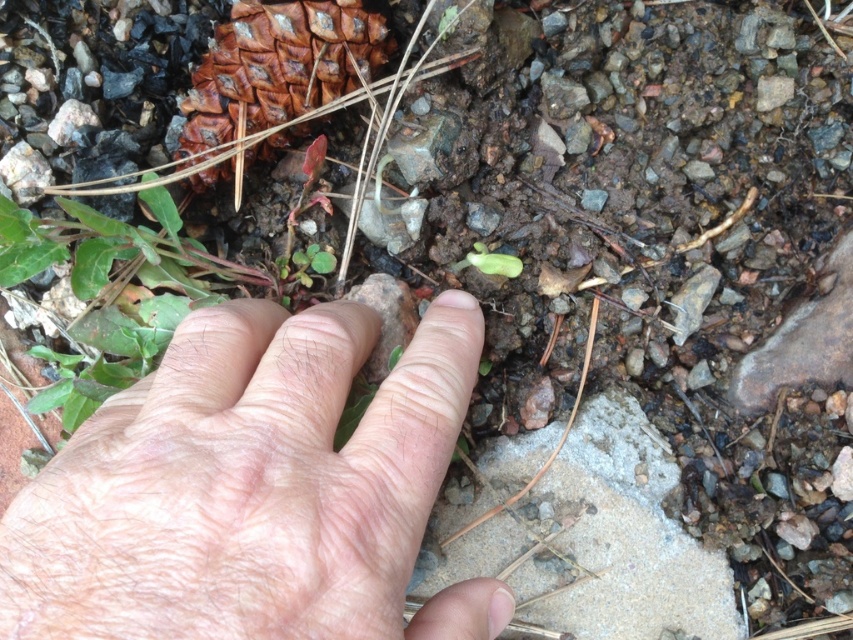
Question: Is the position of pale skin at center less distant than that of gray concrete stone at center?

Choices:
 (A) yes
 (B) no

Answer: (A)

Question: Which object is farther from the camera taking this photo?

Choices:
 (A) pale skin at center
 (B) gray concrete stone at center
 (C) green matte seedling at center

Answer: (C)

Question: Which object is positioned closest to the green matte seedling at center?

Choices:
 (A) pale skin at center
 (B) gray concrete stone at center

Answer: (B)

Question: Does pale skin at center appear on the right side of green matte seedling at center?

Choices:
 (A) no
 (B) yes

Answer: (A)

Question: Which point is closer to the camera taking this photo?

Choices:
 (A) (718, 630)
 (B) (189, 340)

Answer: (B)

Question: Is gray concrete stone at center positioned in front of green matte seedling at center?

Choices:
 (A) no
 (B) yes

Answer: (B)